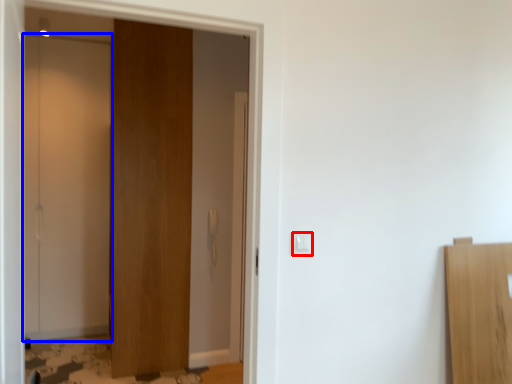
Question: Which object is closer to the camera taking this photo, light switch (highlighted by a red box) or door (highlighted by a blue box)?

Choices:
 (A) light switch
 (B) door

Answer: (A)